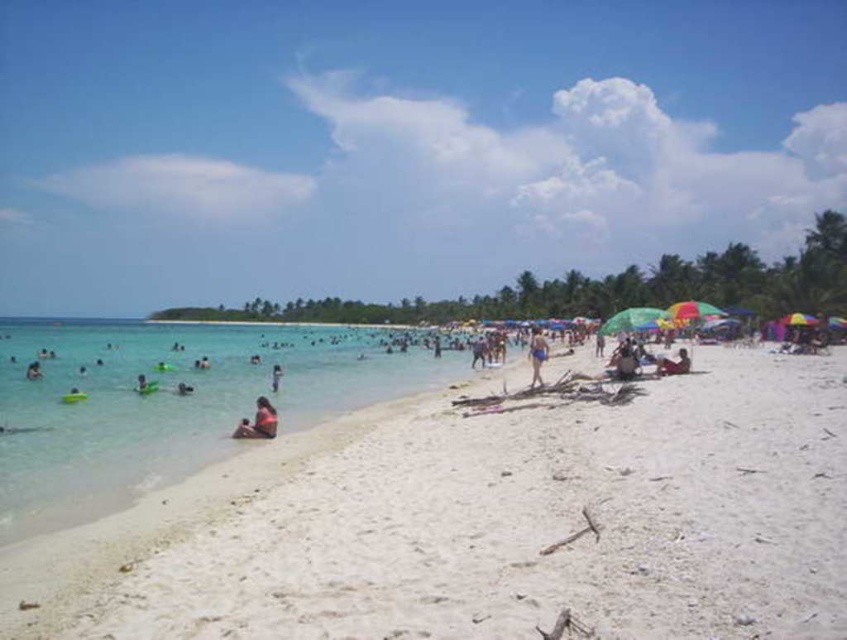
Question: Among these points, which one is farthest from the camera?

Choices:
 (A) (530, 339)
 (B) (685, 355)
 (C) (656, 330)

Answer: (A)

Question: Does purple fabric bikini at center have a greater width compared to tan skin person at center?

Choices:
 (A) no
 (B) yes

Answer: (B)

Question: Considering the real-world distances, which object is closest to the green fabric umbrella at center-right?

Choices:
 (A) purple fabric bikini at center
 (B) tan skin person at center
 (C) green plastic float at left
 (D) dark brown skin at lower right

Answer: (D)

Question: From the image, what is the correct spatial relationship of white sand beach at center in relation to green plastic float at left?

Choices:
 (A) above
 (B) below

Answer: (B)

Question: Can you confirm if purple fabric bikini at center is positioned below tan skin person at center?

Choices:
 (A) no
 (B) yes

Answer: (A)

Question: Among these points, which one is farthest from the camera?

Choices:
 (A) (573, 604)
 (B) (540, 332)
 (C) (36, 369)

Answer: (B)